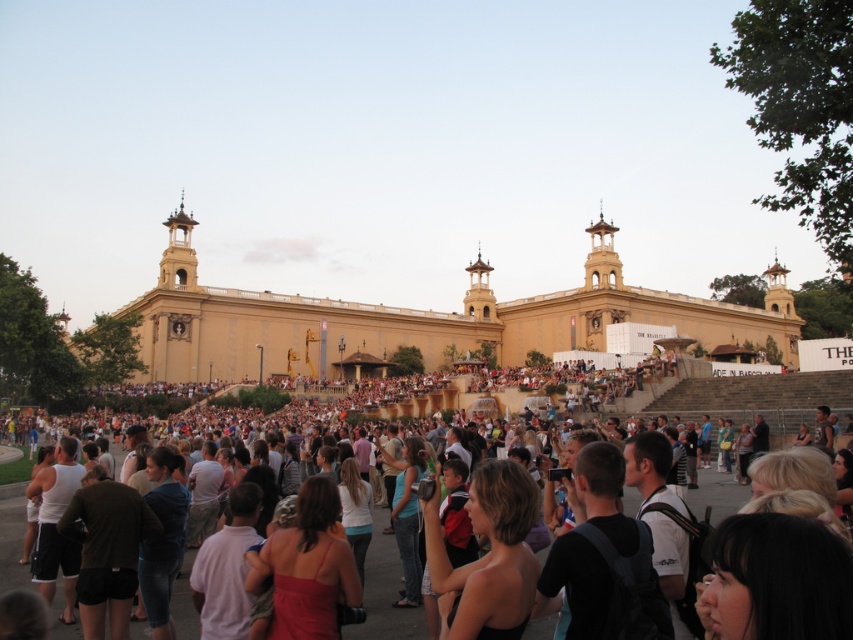
Who is more distant from viewer, (309, 312) or (64, 632)?

The point (309, 312) is more distant.

What do you see at coordinates (419, 320) in the screenshot? The width and height of the screenshot is (853, 640). I see `golden stone church at center` at bounding box center [419, 320].

You are a GUI agent. You are given a task and a screenshot of the screen. Output one action in this format:
    pyautogui.click(x=<x>, y=<y>)
    Task: Click on the golden stone church at center
    
    Given the screenshot: What is the action you would take?
    pyautogui.click(x=419, y=320)